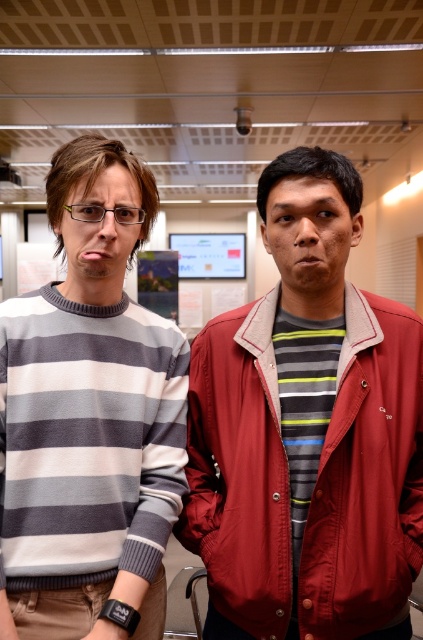
Question: Does matte red jacket at center appear under striped wool sweater at left?

Choices:
 (A) yes
 (B) no

Answer: (A)

Question: Among these objects, which one is nearest to the camera?

Choices:
 (A) matte red jacket at center
 (B) striped wool sweater at left

Answer: (B)

Question: Among these points, which one is nearest to the camera?

Choices:
 (A) (329, 413)
 (B) (87, 147)

Answer: (B)

Question: Does matte red jacket at center have a lesser width compared to striped wool sweater at left?

Choices:
 (A) no
 (B) yes

Answer: (A)

Question: Can you confirm if matte red jacket at center is wider than striped wool sweater at left?

Choices:
 (A) no
 (B) yes

Answer: (B)